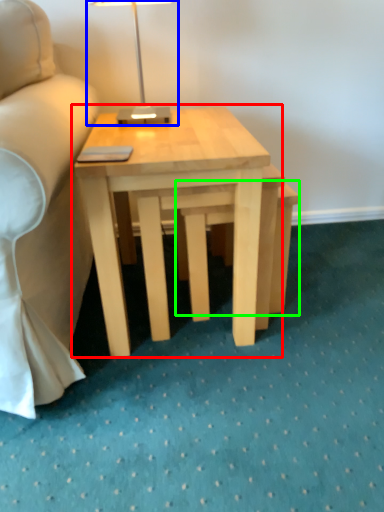
Question: Which is nearer to the coffee table (highlighted by a red box)? table lamp (highlighted by a blue box) or step stool (highlighted by a green box).

Choices:
 (A) table lamp
 (B) step stool

Answer: (B)